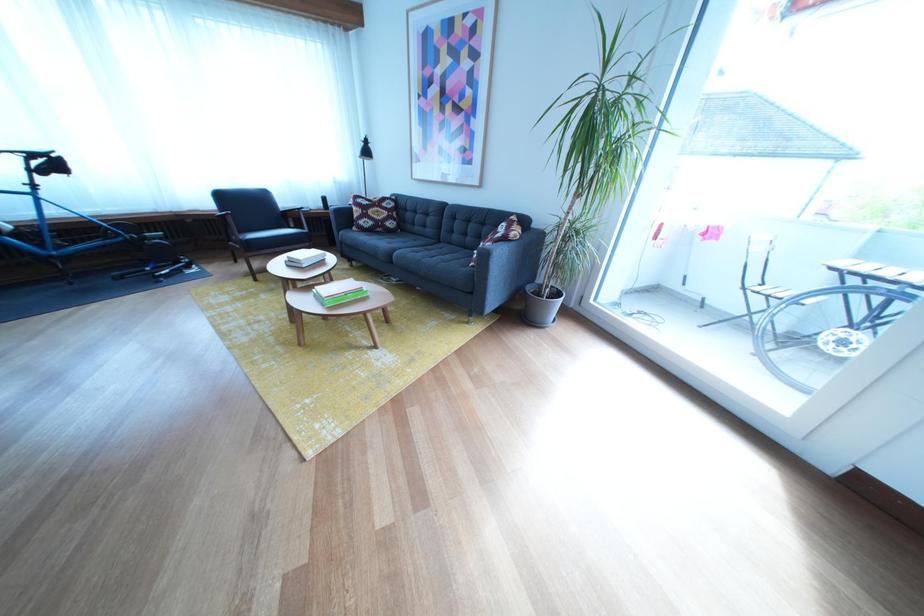
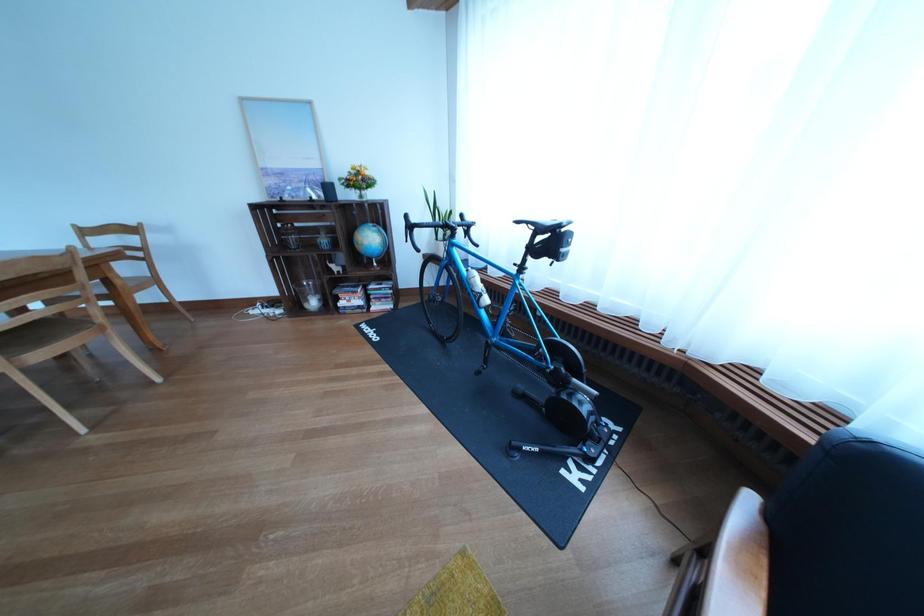
In the second image, find the point that corresponds to point (64, 169) in the first image.

(563, 248)